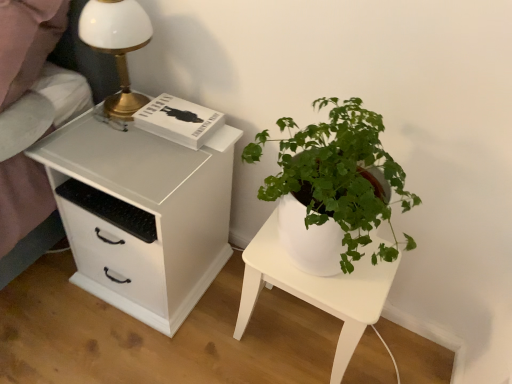
At what (x,y) coordinates should I click in order to perform the action: click on empty space that is in between white matte chest of drawers at left and white glossy nightstand at lower right. Please return your answer as a coordinate pair (x, y). Image resolution: width=512 pixels, height=384 pixels. Looking at the image, I should click on (226, 331).